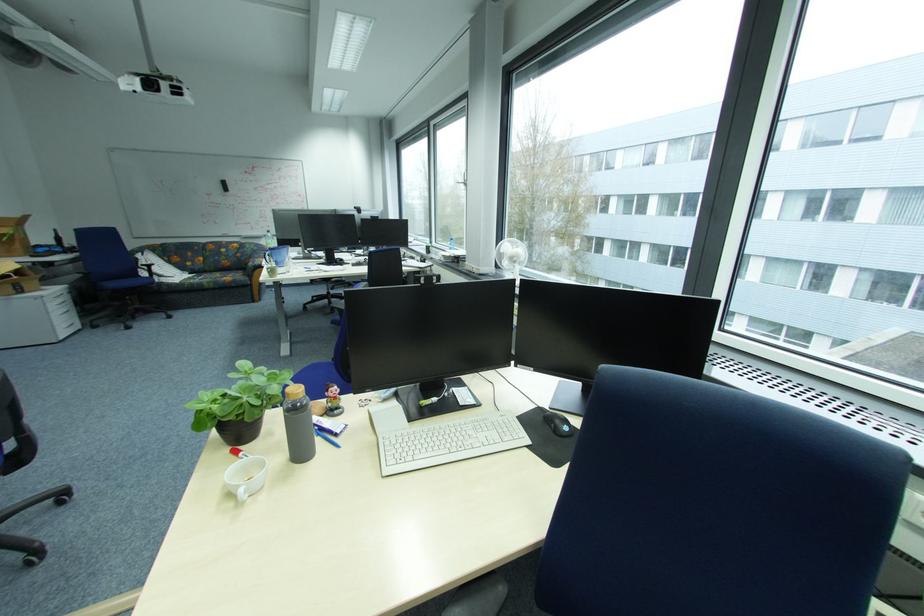
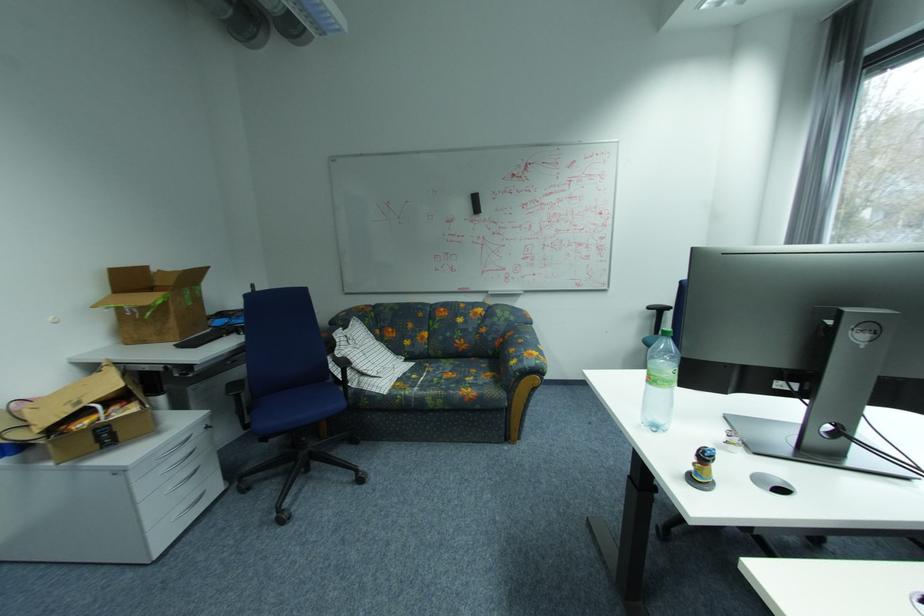
The point at (259, 265) is marked in the first image. Where is the corresponding point in the second image?

(521, 363)